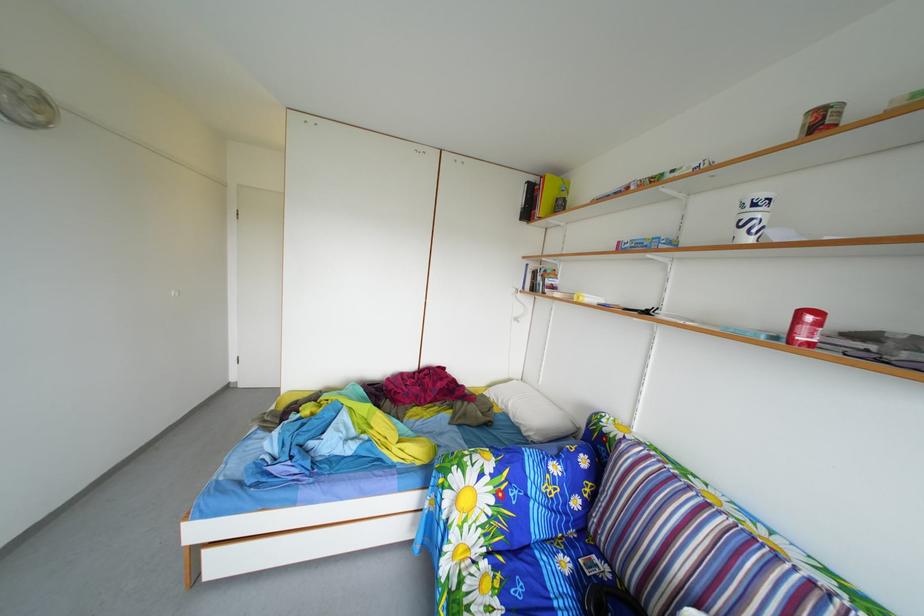
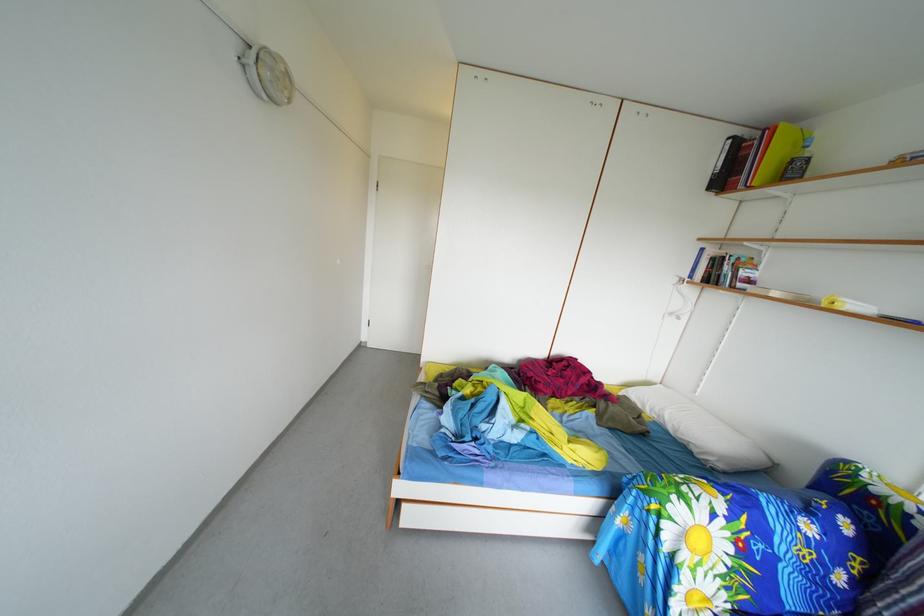
Question: The camera is either moving clockwise (left) or counter-clockwise (right) around the object. The first image is from the beginning of the video and the second image is from the end. Is the camera moving left or right when shooting the video?

Choices:
 (A) Left
 (B) Right

Answer: (B)